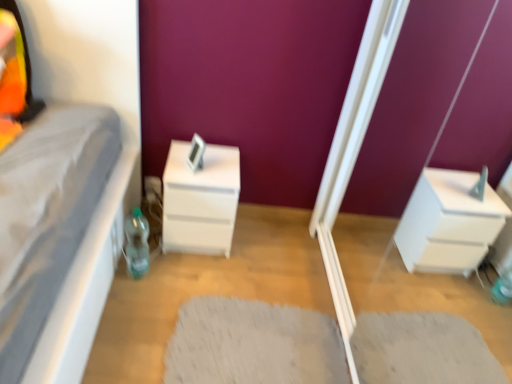
Question: Should I look upward or downward to see translucent plastic bottle at lower left?

Choices:
 (A) up
 (B) down

Answer: (B)

Question: Does white matte chest of drawers at center have a greater height compared to white glossy screen door at lower right?

Choices:
 (A) yes
 (B) no

Answer: (B)

Question: Does white matte chest of drawers at center have a smaller size compared to white glossy screen door at lower right?

Choices:
 (A) no
 (B) yes

Answer: (B)

Question: Is white glossy screen door at lower right at the back of white matte chest of drawers at center?

Choices:
 (A) yes
 (B) no

Answer: (B)

Question: Is white matte chest of drawers at center positioned behind white glossy screen door at lower right?

Choices:
 (A) no
 (B) yes

Answer: (B)

Question: Is white matte chest of drawers at center at the right side of white glossy screen door at lower right?

Choices:
 (A) yes
 (B) no

Answer: (B)

Question: Is white matte chest of drawers at center located outside white glossy screen door at lower right?

Choices:
 (A) yes
 (B) no

Answer: (A)

Question: Is white shaggy rug at center far away from white matte chest of drawers at center?

Choices:
 (A) no
 (B) yes

Answer: (A)

Question: Is white matte chest of drawers at center a part of white shaggy rug at center?

Choices:
 (A) yes
 (B) no

Answer: (B)

Question: Considering the relative sizes of white shaggy rug at center and white matte chest of drawers at center in the image provided, is white shaggy rug at center wider than white matte chest of drawers at center?

Choices:
 (A) no
 (B) yes

Answer: (B)

Question: Can you confirm if white shaggy rug at center is thinner than white matte chest of drawers at center?

Choices:
 (A) yes
 (B) no

Answer: (B)

Question: Is white shaggy rug at center facing towards white matte chest of drawers at center?

Choices:
 (A) no
 (B) yes

Answer: (A)

Question: Is white shaggy rug at center to the right of white matte chest of drawers at center from the viewer's perspective?

Choices:
 (A) no
 (B) yes

Answer: (B)

Question: Considering the relative sizes of white shaggy rug at center and white glossy screen door at lower right in the image provided, is white shaggy rug at center wider than white glossy screen door at lower right?

Choices:
 (A) yes
 (B) no

Answer: (A)